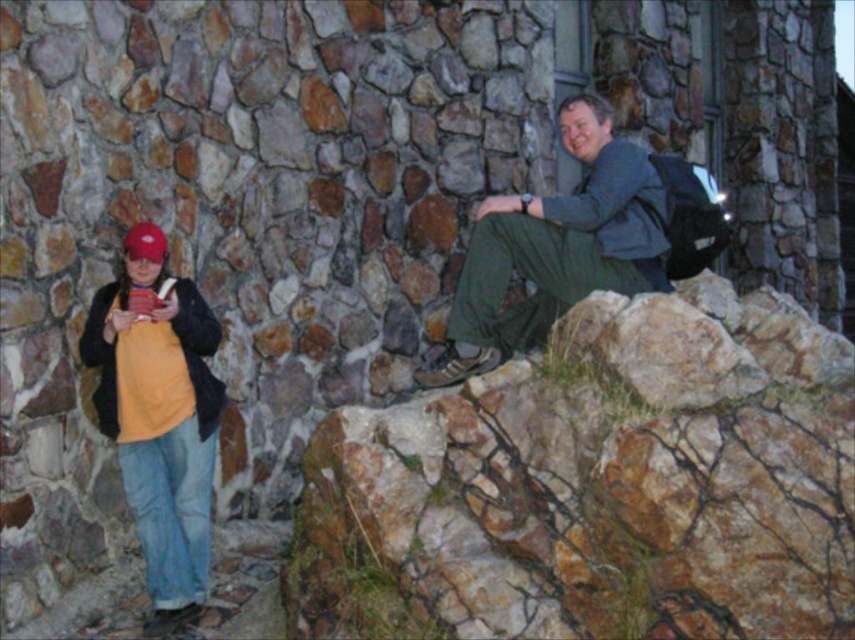
Is point (618, 477) farther from viewer compared to point (187, 284)?

No.

The height and width of the screenshot is (640, 855). What do you see at coordinates (600, 483) in the screenshot?
I see `brown rough rock at upper right` at bounding box center [600, 483].

The image size is (855, 640). I want to click on brown rough rock at upper right, so click(600, 483).

Is matte yellow shirt at left taller than dark green fabric pants at upper right?

Indeed, matte yellow shirt at left has a greater height compared to dark green fabric pants at upper right.

Does matte yellow shirt at left have a lesser height compared to dark green fabric pants at upper right?

Incorrect, matte yellow shirt at left's height does not fall short of dark green fabric pants at upper right's.

Measure the distance between matte yellow shirt at left and camera.

They are 5.17 meters apart.

At what (x,y) coordinates should I click in order to perform the action: click on matte yellow shirt at left. Please return your answer as a coordinate pair (x, y). Looking at the image, I should click on (158, 413).

Describe the element at coordinates (158, 413) in the screenshot. I see `matte yellow shirt at left` at that location.

Can you confirm if matte yellow shirt at left is shorter than yellow fleece at left?

No, matte yellow shirt at left is not shorter than yellow fleece at left.

Does point (133, 243) lie in front of point (104, 362)?

Yes, point (133, 243) is closer to viewer.

Where is `matte yellow shirt at left`? This screenshot has height=640, width=855. matte yellow shirt at left is located at coordinates (158, 413).